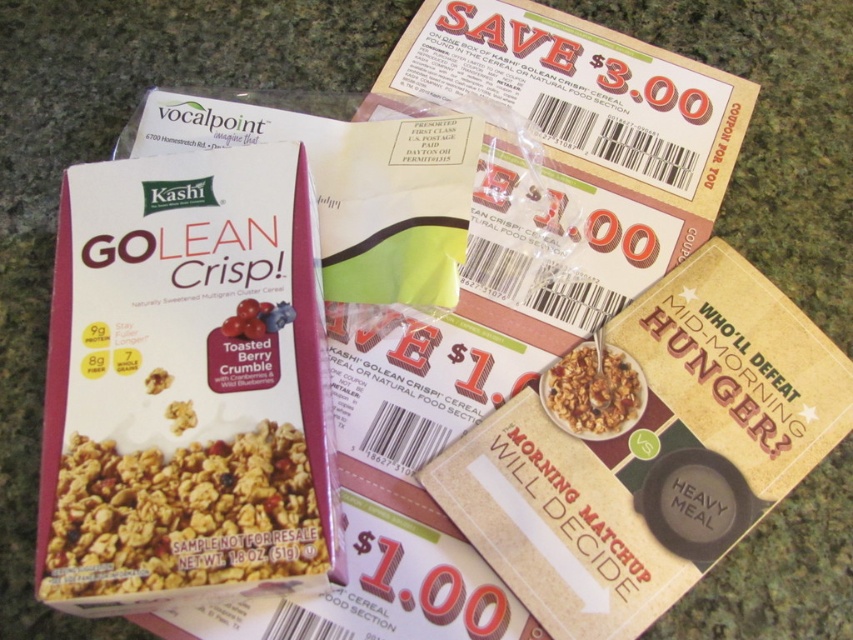
You are holding a ruler and want to measure the distance between the coupon and the cereal box. The coupon is at point (77, 576). Can you reach it with a ruler that measures up to 30 inches?

The coupon at point (77, 576) is 28.28 inches away from the viewer, so yes, the ruler can measure the distance since it is within the 30 inches limit.

You are organizing a pantry and see the matte brown granola at center and the granular textured cereal at center. Which one is positioned to the left?

The matte brown granola at center is positioned to the left of the granular textured cereal at center.

You are trying to determine which item is taller between the matte brown granola at center and the granular textured cereal at center on the countertop. Based on the scene described, which one is taller?

The matte brown granola at center is taller than the granular textured cereal at center.